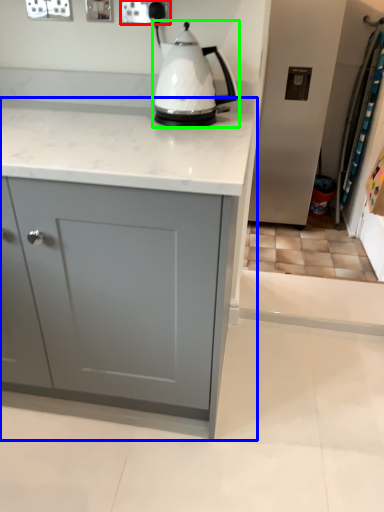
Question: Based on their relative distances, which object is farther from electric outlet (highlighted by a red box)? Choose from cabinetry (highlighted by a blue box) and kettle (highlighted by a green box).

Choices:
 (A) cabinetry
 (B) kettle

Answer: (A)